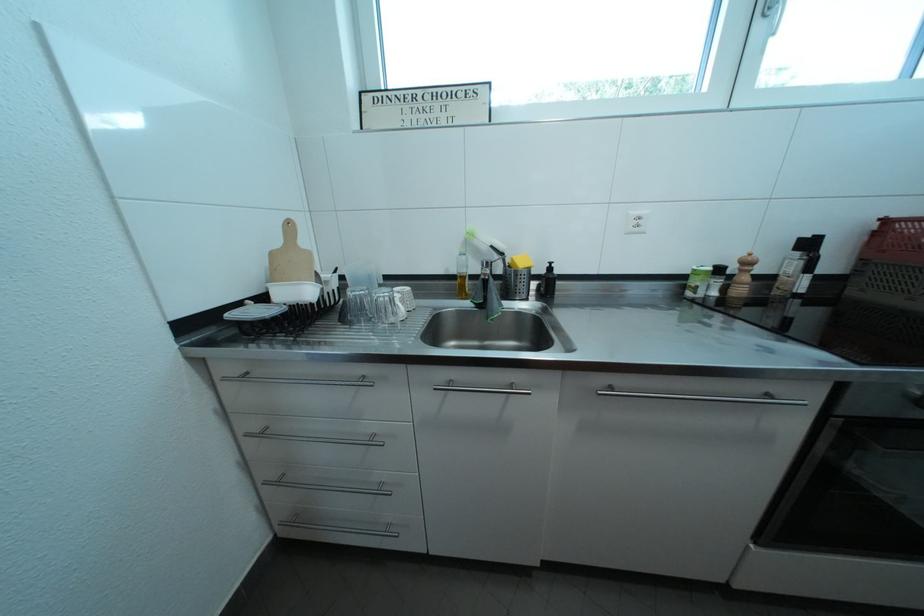
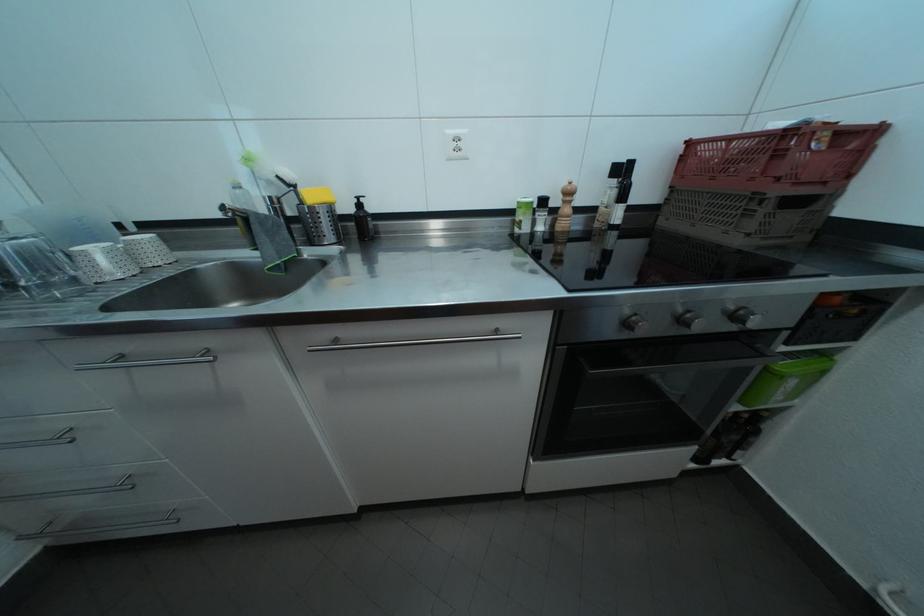
Locate, in the second image, the point that corresponds to [512,260] in the first image.

(304, 192)